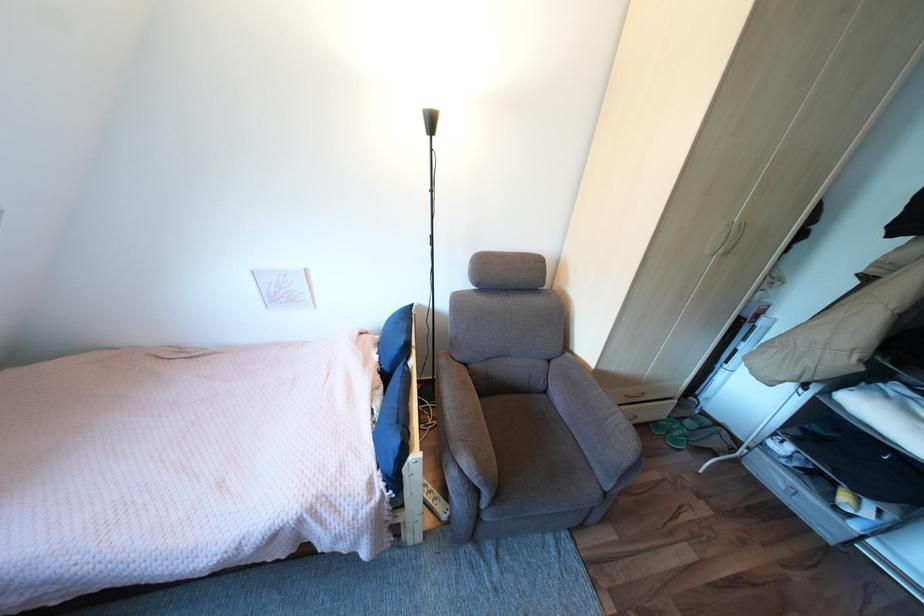
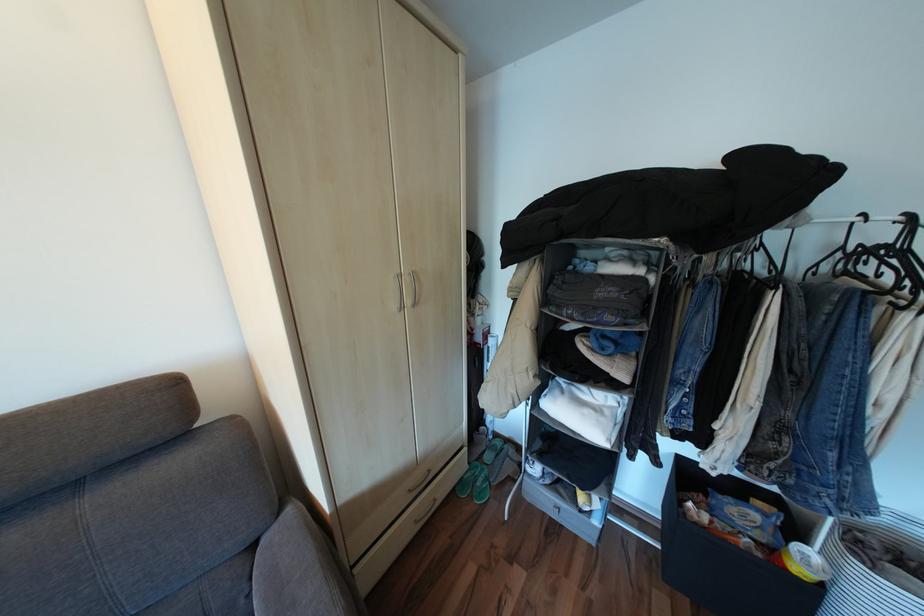
Question: The camera is either moving clockwise (left) or counter-clockwise (right) around the object. The first image is from the beginning of the video and the second image is from the end. Is the camera moving left or right when shooting the video?

Choices:
 (A) Left
 (B) Right

Answer: (A)